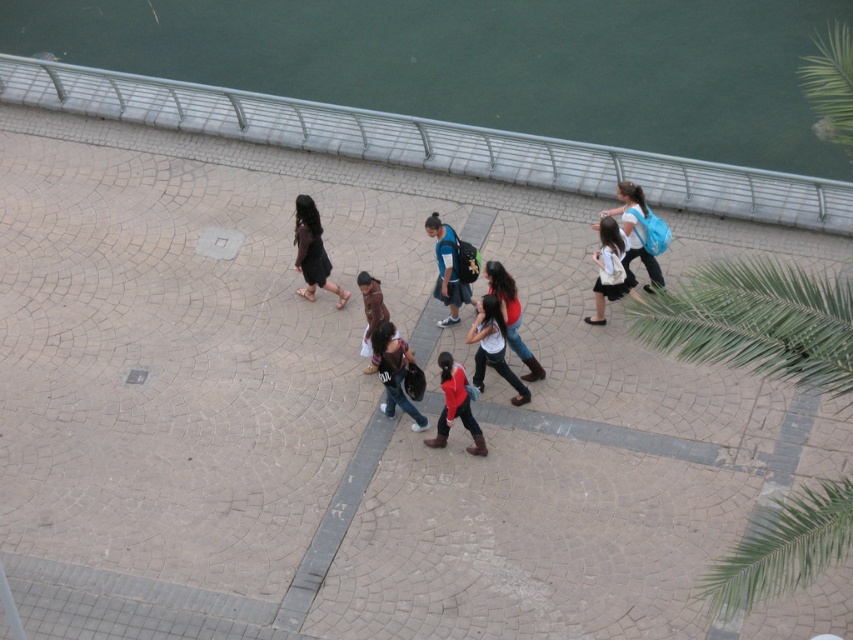
You are standing at the center of the curved pathway and see the matte blue backpack at right. If you want to reach the backpack quickly, which direction should you walk towards?

The matte blue backpack at right is located at point (636, 234), so you should walk towards the right side of the pathway to reach it quickly.

You are a photographer standing on the curved pathway and want to take a photo of the matte blue backpack at right and the matte red shirt at center. Which object should you focus on first to ensure both are in the frame?

The matte blue backpack at right is closer to you than the matte red shirt at center, so focus on the matte blue backpack at right first to ensure both are in the frame.

You are a photographer trying to capture a photo of the matte red shirt at center and the green leafy palm tree at right. Since you want the palm tree to appear larger in the photo than the shirt, which object should you move closer to?

To make the green leafy palm tree at right appear larger than the matte red shirt at center in the photo, you should move closer to the green leafy palm tree at right because it is physically bigger than the matte red shirt at center.